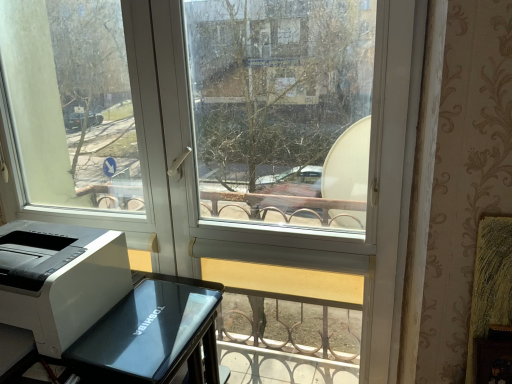
Question: Is white glossy printer at lower left taller or shorter than white plastic printer at lower left?

Choices:
 (A) short
 (B) tall

Answer: (B)

Question: Considering their positions, is white glossy printer at lower left located in front of or behind white plastic printer at lower left?

Choices:
 (A) behind
 (B) front

Answer: (B)

Question: From the image's perspective, is white glossy printer at lower left located above or below white plastic printer at lower left?

Choices:
 (A) above
 (B) below

Answer: (B)

Question: From the image's perspective, is white plastic printer at lower left above or below white glossy printer at lower left?

Choices:
 (A) below
 (B) above

Answer: (B)

Question: Based on their sizes in the image, would you say white plastic printer at lower left is bigger or smaller than white glossy printer at lower left?

Choices:
 (A) small
 (B) big

Answer: (A)

Question: From a real-world perspective, relative to white glossy printer at lower left, is white plastic printer at lower left vertically above or below?

Choices:
 (A) above
 (B) below

Answer: (A)

Question: Is white plastic printer at lower left inside or outside of white glossy printer at lower left?

Choices:
 (A) outside
 (B) inside

Answer: (A)